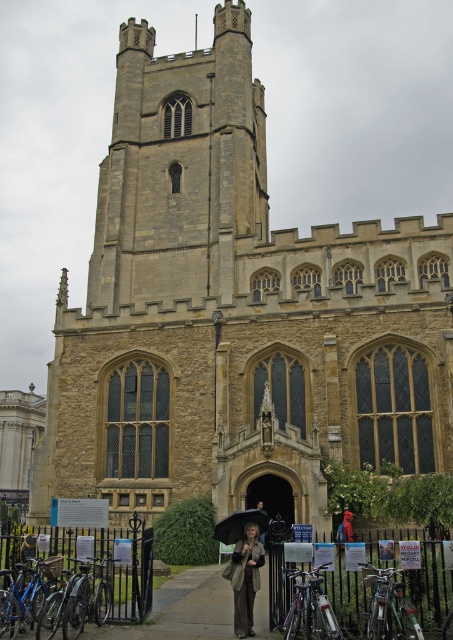
You are standing in front of the historic stone building and see the matte beige coat at center and the blue metallic bicycle at lower left. Which object is closer to you?

The matte beige coat at center is closer to you because the blue metallic bicycle at lower left is behind it.

You are standing in front of a historic stone building with a tall tower and pointed arch windows. There is a specific point marked at coordinates point (255, 541). If you want to move closer to this point, which direction should you move relative to the building?

The point (255, 541) is 29.74 meters away from you, so you should move forward towards the building to get closer to it.